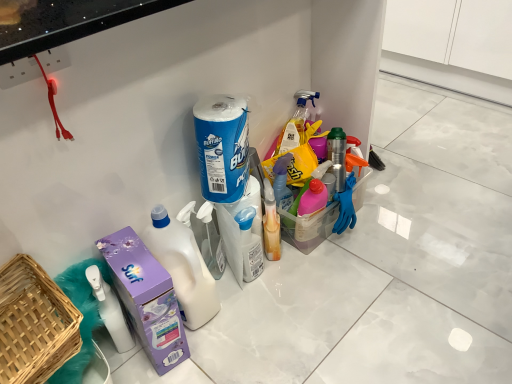
Question: Considering the relative sizes of woven wood basket at lower left and blue paper towel roll at center, which is the first cleaning product from top to bottom, in the image provided, is woven wood basket at lower left smaller than blue paper towel roll at center, which is the first cleaning product from top to bottom,?

Choices:
 (A) no
 (B) yes

Answer: (A)

Question: From a real-world perspective, is woven wood basket at lower left below blue paper towel roll at center, which is the first cleaning product from top to bottom?

Choices:
 (A) yes
 (B) no

Answer: (A)

Question: Could you tell me if woven wood basket at lower left is turned towards blue paper towel roll at center, the second cleaning product from the bottom?

Choices:
 (A) yes
 (B) no

Answer: (B)

Question: Is woven wood basket at lower left not within blue paper towel roll at center, which is the first cleaning product from top to bottom?

Choices:
 (A) no
 (B) yes

Answer: (B)

Question: Could blue paper towel roll at center, which is the first cleaning product from top to bottom, be considered to be inside woven wood basket at lower left?

Choices:
 (A) yes
 (B) no

Answer: (B)

Question: Choose the correct answer: Is purple cardboard carton at lower left inside white plastic spray bottle at center, which is the 2th cleaning product from top to bottom, or outside it?

Choices:
 (A) outside
 (B) inside

Answer: (A)

Question: Based on their positions, is purple cardboard carton at lower left located to the left or right of white plastic spray bottle at center, which is the 2th cleaning product from top to bottom?

Choices:
 (A) right
 (B) left

Answer: (B)

Question: Is purple cardboard carton at lower left wider or thinner than white plastic spray bottle at center, which is the 2th cleaning product from top to bottom?

Choices:
 (A) wide
 (B) thin

Answer: (A)

Question: Considering the positions of point (163, 276) and point (247, 221), is point (163, 276) closer or farther from the camera than point (247, 221)?

Choices:
 (A) farther
 (B) closer

Answer: (B)

Question: Considering their positions, is white plastic bottle at center located in front of or behind white plastic spray bottle at center, which is the 2th cleaning product from top to bottom?

Choices:
 (A) front
 (B) behind

Answer: (A)

Question: In the image, is white plastic bottle at center on the left side or the right side of white plastic spray bottle at center, which ranks as the first cleaning product in bottom-to-top order?

Choices:
 (A) right
 (B) left

Answer: (B)

Question: Is point (157, 235) positioned closer to the camera than point (261, 238)?

Choices:
 (A) farther
 (B) closer

Answer: (B)

Question: Is white plastic bottle at center bigger or smaller than white plastic spray bottle at center, which ranks as the first cleaning product in bottom-to-top order?

Choices:
 (A) big
 (B) small

Answer: (A)

Question: Based on their sizes in the image, would you say white plastic bottle at center is bigger or smaller than purple cardboard carton at lower left?

Choices:
 (A) small
 (B) big

Answer: (A)

Question: Would you say white plastic bottle at center is inside or outside purple cardboard carton at lower left?

Choices:
 (A) inside
 (B) outside

Answer: (B)